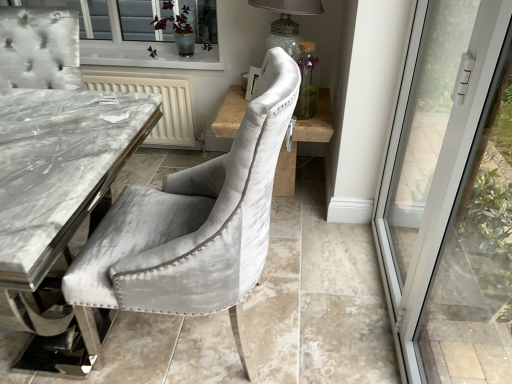
The image size is (512, 384). Identify the location of vacant space that's between transparent glass door at right and velvet grey chair at center. (325, 293).